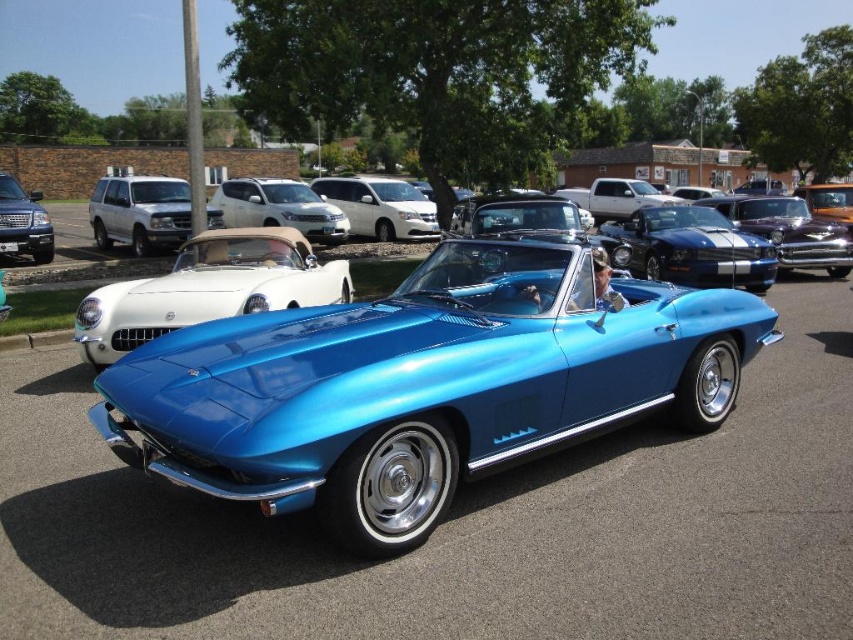
Between metallic blue car at center and shiny white convertible at center, which one appears on the left side from the viewer's perspective?

From the viewer's perspective, shiny white convertible at center appears more on the left side.

Which is in front, point (506, 496) or point (96, 304)?

Point (506, 496) is in front.

You are a GUI agent. You are given a task and a screenshot of the screen. Output one action in this format:
    pyautogui.click(x=<x>, y=<y>)
    Task: Click on the metallic blue car at center
    This screenshot has width=853, height=640.
    Given the screenshot: What is the action you would take?
    pyautogui.click(x=460, y=525)

Is matte white suv at upper left closer to the viewer compared to satin white minivan at center?

Yes, matte white suv at upper left is in front of satin white minivan at center.

This screenshot has height=640, width=853. In order to click on matte white suv at upper left in this screenshot , I will do `click(140, 212)`.

Can you confirm if shiny metallic car at center is positioned to the left of matte silver suv at left?

In fact, shiny metallic car at center is to the right of matte silver suv at left.

Between shiny metallic car at center and matte silver suv at left, which one is positioned higher?

matte silver suv at left is above.

Between point (815, 266) and point (36, 198), which one is positioned behind?

Positioned behind is point (36, 198).

You are a GUI agent. You are given a task and a screenshot of the screen. Output one action in this format:
    pyautogui.click(x=<x>, y=<y>)
    Task: Click on the shiny metallic car at center
    
    Given the screenshot: What is the action you would take?
    pyautogui.click(x=788, y=230)